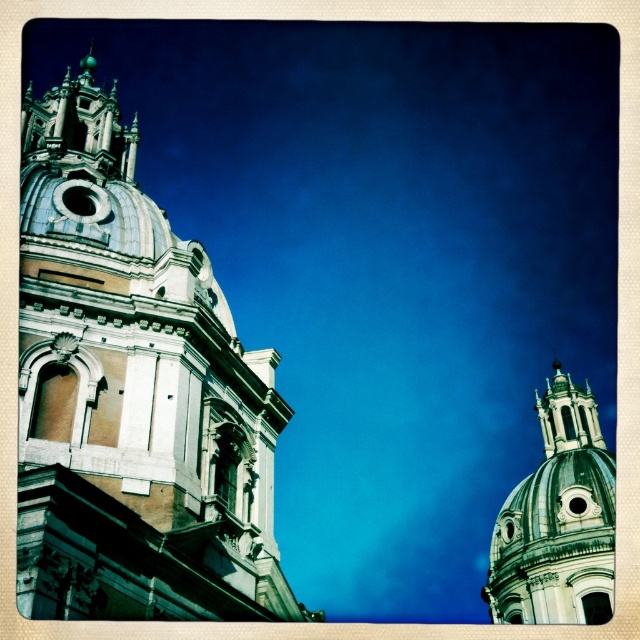
You are an architect planning to place a 10m wide statue between the white stone church at left and the white marble dome at upper right. Based on their widths, can the statue fit between them?

The white stone church at left might be wider than white marble dome at upper right, so the statue could potentially fit between them if the combined width of both structures allows space. However, the exact dimensions are uncertain without precise measurements.

You are an architect analyzing the layout of this architectural scene. You need to determine the relative positioning of the white stone church at left and the white marble dome at upper right. Which object is positioned to the left of the other?

The white stone church at left is to the left of the white marble dome at upper right.

You are standing at the center of the image and want to locate the white stone church at left. According to the coordinates given, in which direction should you look to find it?

The white stone church at left is located at coordinates point (x=132, y=394), which means it is positioned to the left and slightly above the center of the image. Therefore, you should look to the left and slightly upwards to locate it.